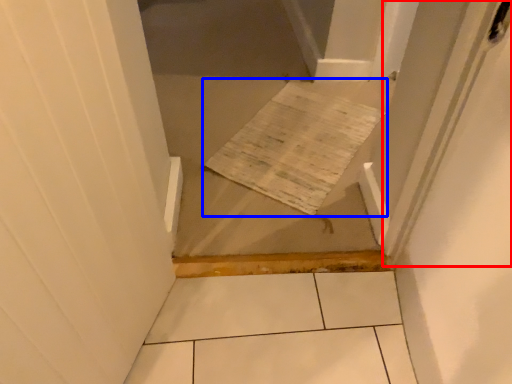
Question: Which object appears farthest to the camera in this image, screen door (highlighted by a red box) or cardboard (highlighted by a blue box)?

Choices:
 (A) screen door
 (B) cardboard

Answer: (B)